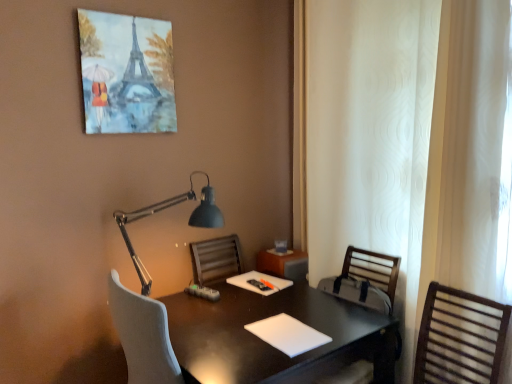
Where is `vacant area that is situated to the right of white matte notepad at center, positioned as the 2th notepad in back-to-front order`? vacant area that is situated to the right of white matte notepad at center, positioned as the 2th notepad in back-to-front order is located at coordinates (346, 322).